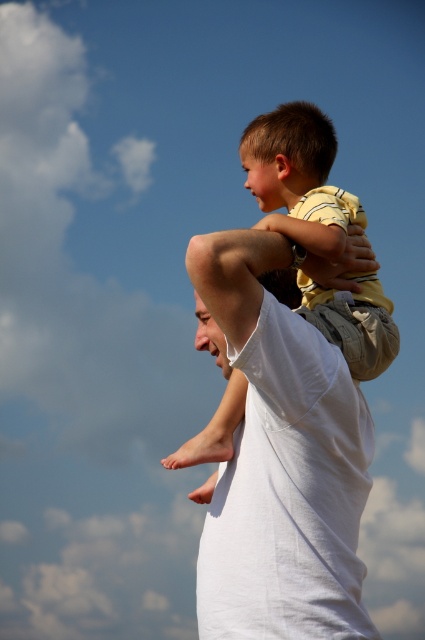
You are a fashion designer observing the scene. You need to determine which shirt is visible on top between the white cotton shirt at center and the light brown cotton shirt at center. Which one is on top?

The light brown cotton shirt at center is on top because the white cotton shirt at center is positioned under it.